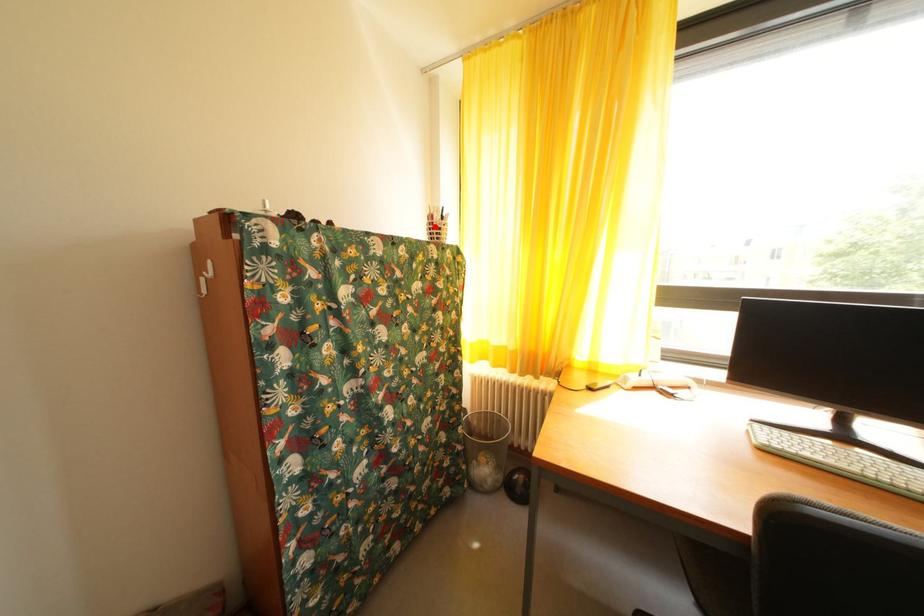
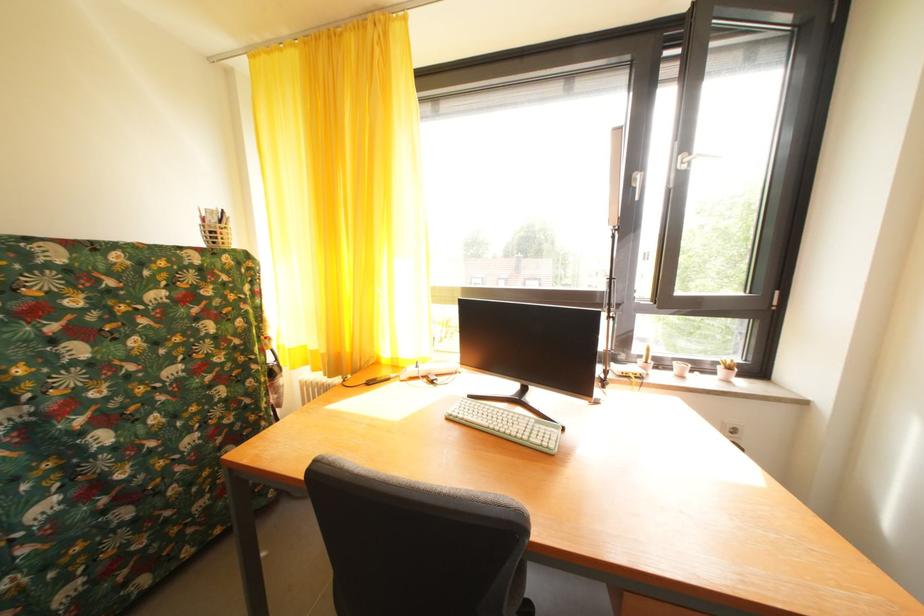
Where in the second image is the point corresponding to the highlighted location from the first image?

(209, 229)